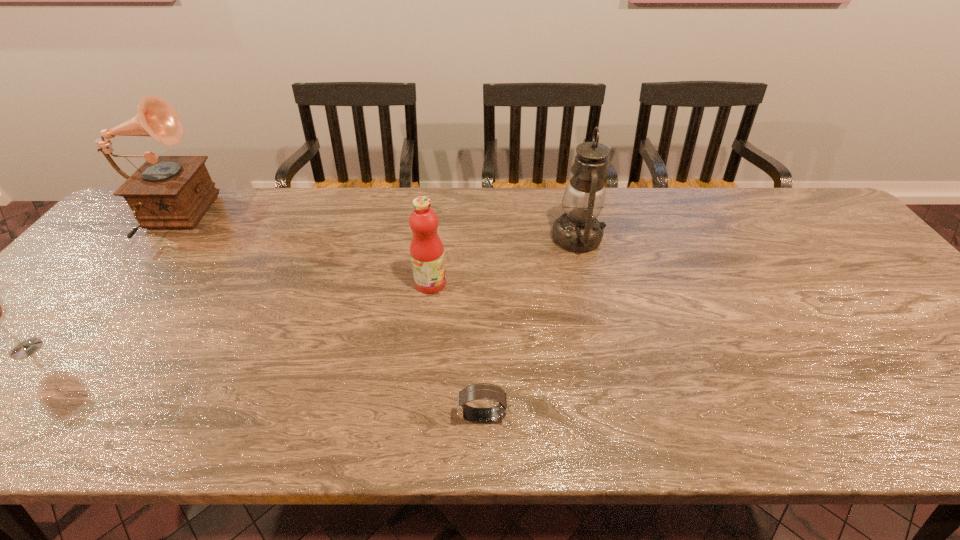
At what (x,y) coordinates should I click in order to perform the action: click on record player. Please return your answer as a coordinate pair (x, y). This screenshot has width=960, height=540. Looking at the image, I should click on (166, 192).

Find the location of a particular element. This screenshot has height=540, width=960. oil lamp is located at coordinates (578, 230).

Identify the location of the third shortest object. (426, 249).

Find the location of a particular element. This screenshot has width=960, height=540. the third object from left to right is located at coordinates (426, 249).

At what (x,y) coordinates should I click in order to perform the action: click on the shortest object. Please return your answer as a coordinate pair (x, y). The width and height of the screenshot is (960, 540). Looking at the image, I should click on 479,391.

In order to click on the fourth object from left to right in this screenshot , I will do `click(479, 391)`.

This screenshot has height=540, width=960. In order to click on vacant space situated 0.060m on the horn of the record player in this screenshot , I will do `click(228, 220)`.

Find the location of `free space located on the right of the rightmost object`. free space located on the right of the rightmost object is located at coordinates (631, 238).

You are a GUI agent. You are given a task and a screenshot of the screen. Output one action in this format:
    pyautogui.click(x=<x>, y=<y>)
    Task: Click on the free spot located on the front label of the fruit juice
    This screenshot has height=540, width=960.
    Given the screenshot: What is the action you would take?
    pyautogui.click(x=539, y=283)

Identify the location of blank space located 0.100m on the face of the watch. The height and width of the screenshot is (540, 960). (408, 417).